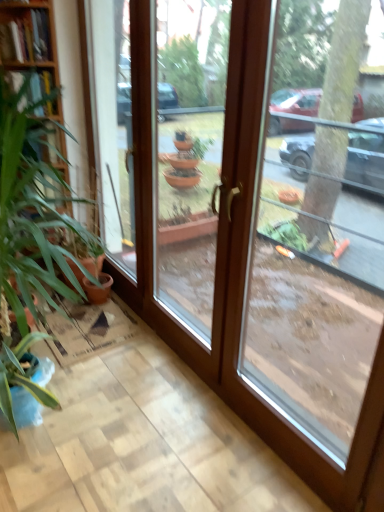
Question: Considering the relative sizes of transparent glass door at center, the first window when ordered from left to right, and transparent glass door at right, positioned as the 1th window in right-to-left order, in the image provided, is transparent glass door at center, the first window when ordered from left to right, bigger than transparent glass door at right, positioned as the 1th window in right-to-left order,?

Choices:
 (A) yes
 (B) no

Answer: (B)

Question: Is transparent glass door at center, positioned as the 2th window in right-to-left order, in front of transparent glass door at right, acting as the 2th window starting from the left?

Choices:
 (A) yes
 (B) no

Answer: (B)

Question: Does transparent glass door at center, the first window when ordered from left to right, lie behind transparent glass door at right, positioned as the 1th window in right-to-left order?

Choices:
 (A) yes
 (B) no

Answer: (A)

Question: Considering the relative sizes of transparent glass door at center, the first window when ordered from left to right, and transparent glass door at right, positioned as the 1th window in right-to-left order, in the image provided, is transparent glass door at center, the first window when ordered from left to right, thinner than transparent glass door at right, positioned as the 1th window in right-to-left order,?

Choices:
 (A) yes
 (B) no

Answer: (A)

Question: From a real-world perspective, does transparent glass door at center, the first window when ordered from left to right, sit lower than transparent glass door at right, acting as the 2th window starting from the left?

Choices:
 (A) no
 (B) yes

Answer: (A)

Question: Is transparent glass door at center, positioned as the 2th window in right-to-left order, smaller than transparent glass door at right, acting as the 2th window starting from the left?

Choices:
 (A) yes
 (B) no

Answer: (A)

Question: From a real-world perspective, is green leafy plant at left located beneath transparent glass door at center, the first window when ordered from left to right?

Choices:
 (A) yes
 (B) no

Answer: (A)

Question: Does green leafy plant at left come behind transparent glass door at center, positioned as the 2th window in right-to-left order?

Choices:
 (A) no
 (B) yes

Answer: (B)

Question: Is green leafy plant at left positioned before transparent glass door at center, positioned as the 2th window in right-to-left order?

Choices:
 (A) yes
 (B) no

Answer: (B)

Question: Is green leafy plant at left taller than transparent glass door at center, the first window when ordered from left to right?

Choices:
 (A) yes
 (B) no

Answer: (B)

Question: Can you confirm if green leafy plant at left is bigger than transparent glass door at center, the first window when ordered from left to right?

Choices:
 (A) yes
 (B) no

Answer: (A)

Question: From a real-world perspective, is green leafy plant at left on top of transparent glass door at center, the first window when ordered from left to right?

Choices:
 (A) yes
 (B) no

Answer: (B)

Question: Does wooden bookshelf at left lie in front of transparent glass door at right, acting as the 2th window starting from the left?

Choices:
 (A) yes
 (B) no

Answer: (B)